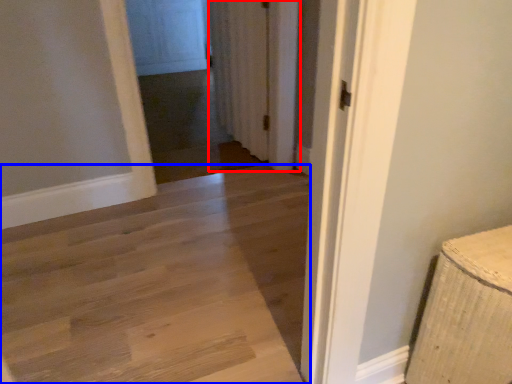
Question: Which object appears farthest to the camera in this image, curtain (highlighted by a red box) or path (highlighted by a blue box)?

Choices:
 (A) curtain
 (B) path

Answer: (A)